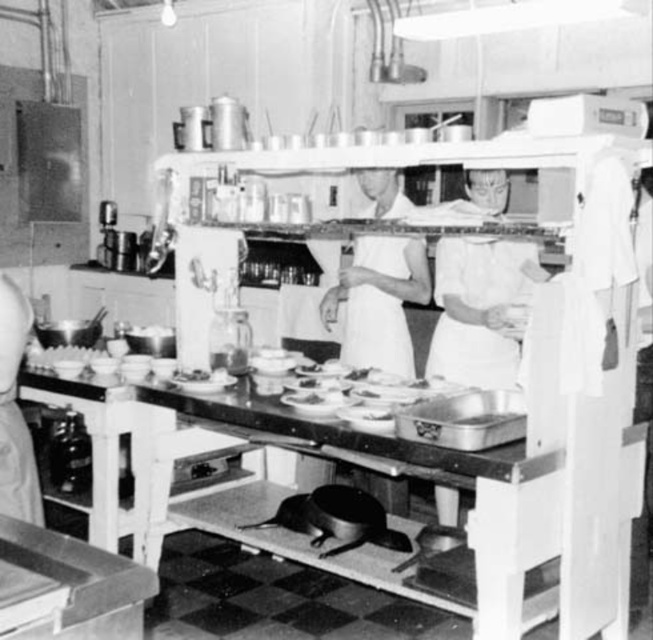
You are a chef in this vintage kitchen and need to choose an apron to wear. Both the white fabric apron at center and the white fabric apron at left are available. Which apron is shorter in height?

The white fabric apron at center is not as tall as the white fabric apron at left, so the white fabric apron at center is shorter in height.

You are a chef standing in the kitchen and want to reach the white cloth at center to wipe a spill. Considering your arm can extend 2.5 meters, will you be able to reach it without moving closer?

The white cloth at center is 12.13 feet from camera. Since 12.13 feet is approximately 3.7 meters, which is longer than your arm extension of 2.5 meters, you cannot reach it without moving closer.